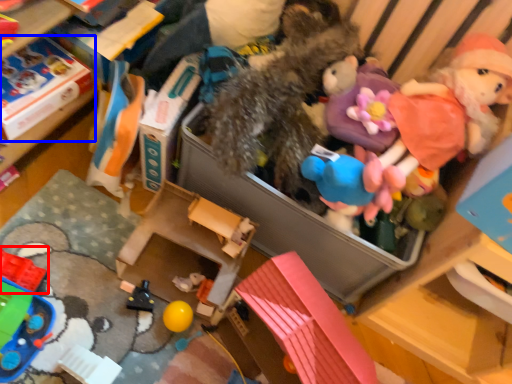
Question: Which object appears farthest to the camera in this image, toy (highlighted by a red box) or storage box (highlighted by a blue box)?

Choices:
 (A) toy
 (B) storage box

Answer: (B)